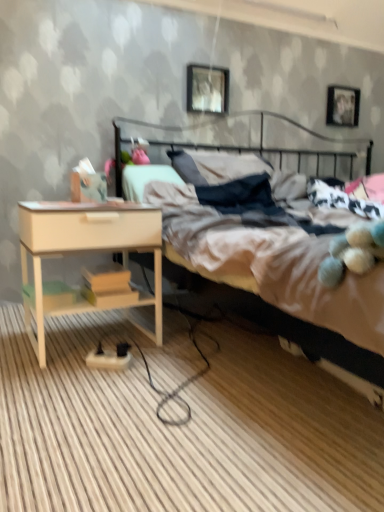
Question: Is metallic bed at center situated inside metallic black headboard at upper center or outside?

Choices:
 (A) inside
 (B) outside

Answer: (B)

Question: From a real-world perspective, is metallic bed at center above or below metallic black headboard at upper center?

Choices:
 (A) above
 (B) below

Answer: (B)

Question: Which of these objects is positioned farthest from the beige wood nightstand at lower left?

Choices:
 (A) metallic black headboard at upper center
 (B) metallic silver picture frame at upper center, acting as the 1th picture frame starting from the front
 (C) metallic bed at center
 (D) metallic silver picture frame at upper right, which appears as the second picture frame when viewed from the left

Answer: (D)

Question: Which is farther from the metallic bed at center?

Choices:
 (A) metallic silver picture frame at upper center, positioned as the 1th picture frame in left-to-right order
 (B) beige wood nightstand at lower left
 (C) metallic black headboard at upper center
 (D) metallic silver picture frame at upper right, which appears as the second picture frame when viewed from the left

Answer: (D)